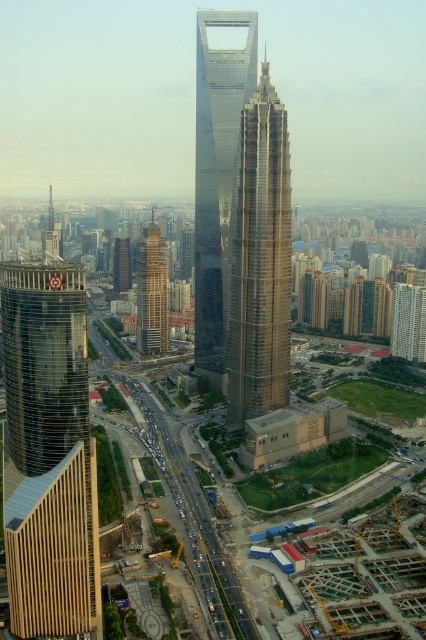
Question: Which of these objects is positioned farthest from the glassy metallic skyscraper at center?

Choices:
 (A) white glass building at center
 (B) gold reflective skyscraper at center
 (C) dark brown glass building at center

Answer: (C)

Question: Does gold reflective skyscraper at center have a larger size compared to white glass building at center?

Choices:
 (A) no
 (B) yes

Answer: (B)

Question: Is brown textured building at center smaller than dark brown glass building at center?

Choices:
 (A) no
 (B) yes

Answer: (A)

Question: Which point is closer to the camera?

Choices:
 (A) click(207, 358)
 (B) click(126, 257)

Answer: (A)

Question: Which object is closer to the camera taking this photo?

Choices:
 (A) dark brown glass building at center
 (B) gold reflective skyscraper at center
 (C) brown textured building at center
 (D) white glass building at center

Answer: (B)

Question: Considering the relative positions of glassy metallic skyscraper at center and brown textured building at center in the image provided, where is glassy metallic skyscraper at center located with respect to brown textured building at center?

Choices:
 (A) left
 (B) right

Answer: (B)